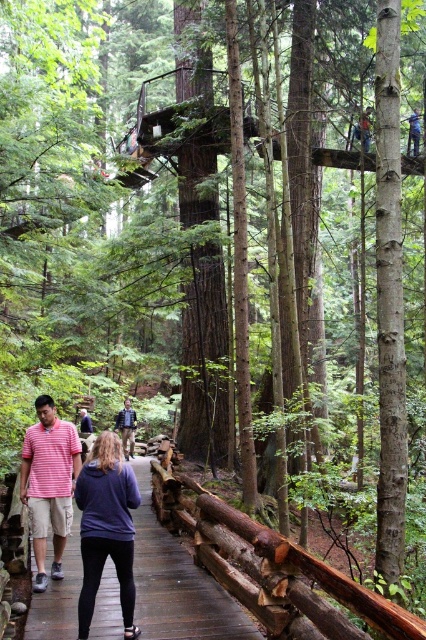
You are standing at the starting point of the wooden walkway in the forest. You see two points marked on the walkway labeled as point (48,524) and point (92,429). Which point is closer to you as you begin walking along the walkway?

Point (48,524) is closer to you because it is in front of point (92,429) along the walkway.